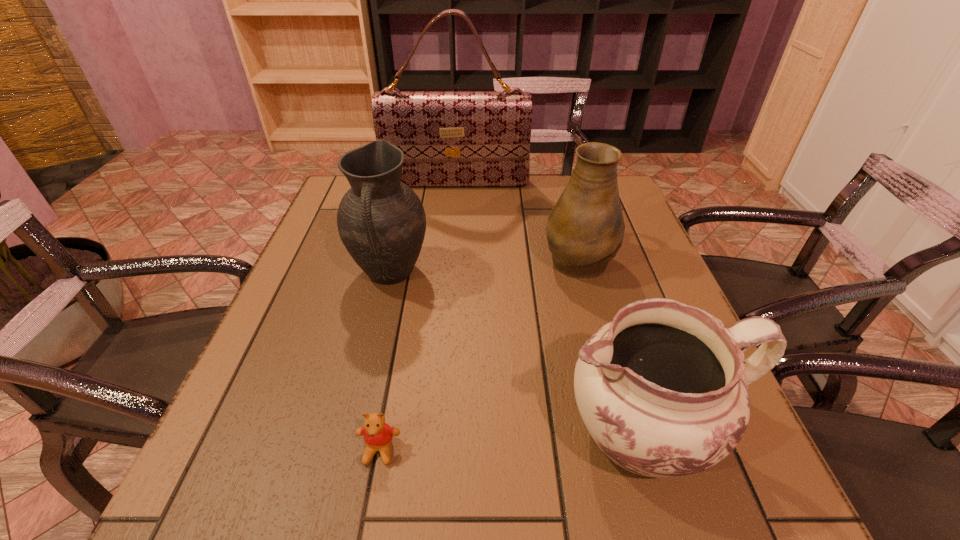
This screenshot has width=960, height=540. Identify the location of the tallest object. (449, 138).

At what (x,y) coordinates should I click in order to perform the action: click on the farthest object. Please return your answer as a coordinate pair (x, y). The height and width of the screenshot is (540, 960). Looking at the image, I should click on (449, 138).

Find the location of a particular element. This screenshot has width=960, height=540. the leftmost pitcher is located at coordinates coord(381,221).

Locate an element on the screen. the second shortest object is located at coordinates (663, 390).

Where is `the shortest pitcher`? The height and width of the screenshot is (540, 960). the shortest pitcher is located at coordinates (663, 390).

Where is `the shortest object`? the shortest object is located at coordinates (378, 435).

Identify the location of vacant point located 0.170m on the front of the farthest object with the clasp. This screenshot has width=960, height=540. (451, 225).

This screenshot has width=960, height=540. Find the location of `free space located 0.050m on the side of the leftmost pitcher with the handle`. free space located 0.050m on the side of the leftmost pitcher with the handle is located at coordinates (379, 320).

Locate an element on the screen. The image size is (960, 540). free space located 0.250m on the spout of the shortest pitcher is located at coordinates (407, 431).

Find the location of a particular element. The image size is (960, 540). free space located 0.080m on the spout of the shortest pitcher is located at coordinates (x=510, y=431).